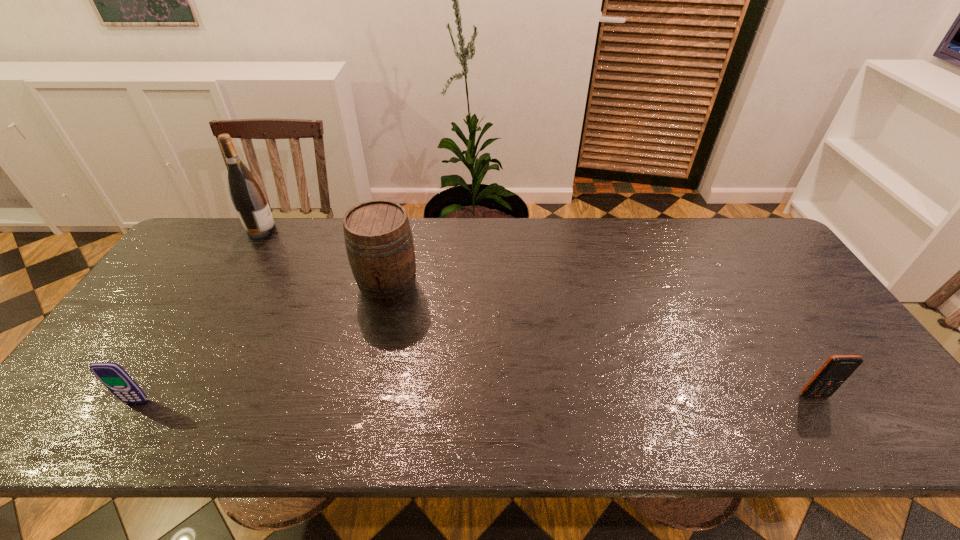
Identify the location of free space at the right edge. The image size is (960, 540). (842, 389).

Locate an element on the screen. This screenshot has height=540, width=960. free space at the far right corner is located at coordinates (758, 244).

You are a GUI agent. You are given a task and a screenshot of the screen. Output one action in this format:
    pyautogui.click(x=<x>, y=<y>)
    Task: Click on the vacant point located between the tallest object and the left cellular telephone
    The image size is (960, 540).
    Given the screenshot: What is the action you would take?
    pyautogui.click(x=199, y=316)

Find the location of `free space that is in between the third farthest object and the second tallest object`. free space that is in between the third farthest object and the second tallest object is located at coordinates (601, 341).

You are a GUI agent. You are given a task and a screenshot of the screen. Output one action in this format:
    pyautogui.click(x=<x>, y=<y>)
    Task: Click on the free space between the second nearest object and the nearest object
    
    Given the screenshot: What is the action you would take?
    pyautogui.click(x=475, y=399)

You are a GUI agent. You are given a task and a screenshot of the screen. Output one action in this format:
    pyautogui.click(x=<x>, y=<y>)
    Task: Click on the vacant region between the second nearest object and the wine bottle
    
    Given the screenshot: What is the action you would take?
    pyautogui.click(x=538, y=313)

Where is `empty space that is in between the farther cellular telephone and the left cellular telephone`? empty space that is in between the farther cellular telephone and the left cellular telephone is located at coordinates (475, 399).

Where is `free spot between the tallest object and the second nearest object`? free spot between the tallest object and the second nearest object is located at coordinates (538, 313).

Locate an element on the screen. free space between the farthest object and the cider is located at coordinates 325,258.

The image size is (960, 540). Identify the location of free spot between the second farthest object and the wine bottle. (325, 258).